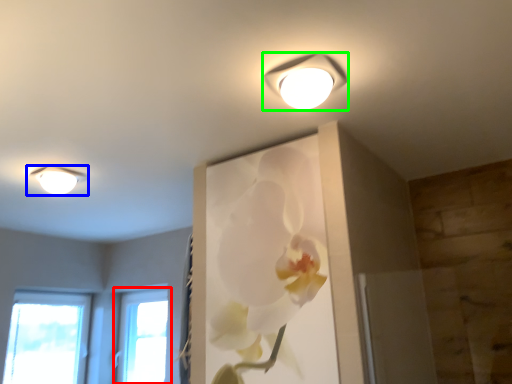
Question: Estimate the real-world distances between objects in this image. Which object is farther from window (highlighted by a red box), lamp (highlighted by a blue box) or lamp (highlighted by a green box)?

Choices:
 (A) lamp
 (B) lamp

Answer: (B)